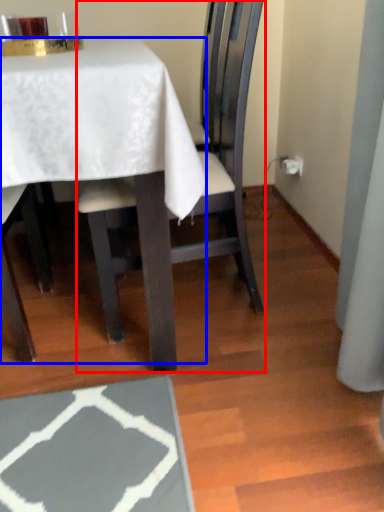
Question: Which object appears closest to the camera in this image, chair (highlighted by a red box) or table (highlighted by a blue box)?

Choices:
 (A) chair
 (B) table

Answer: (B)